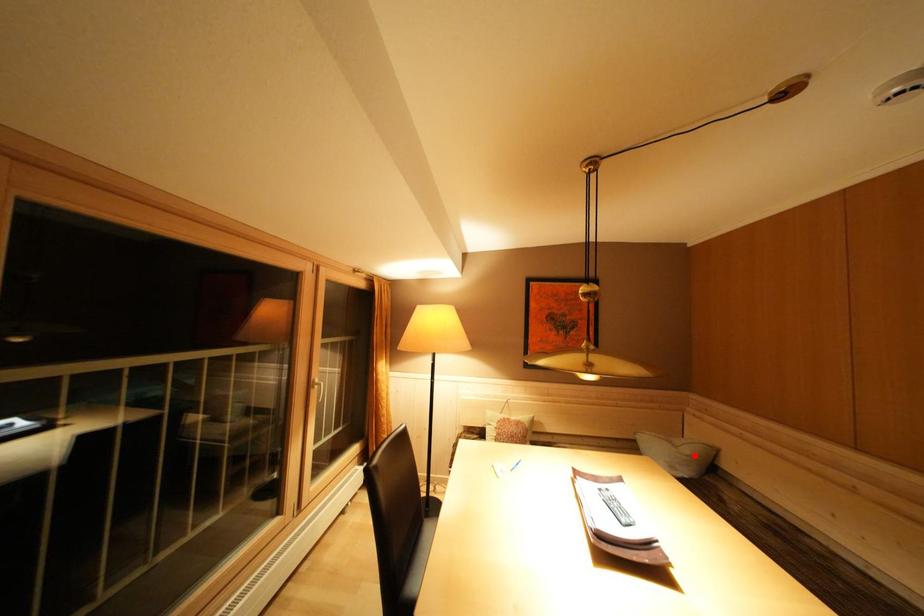
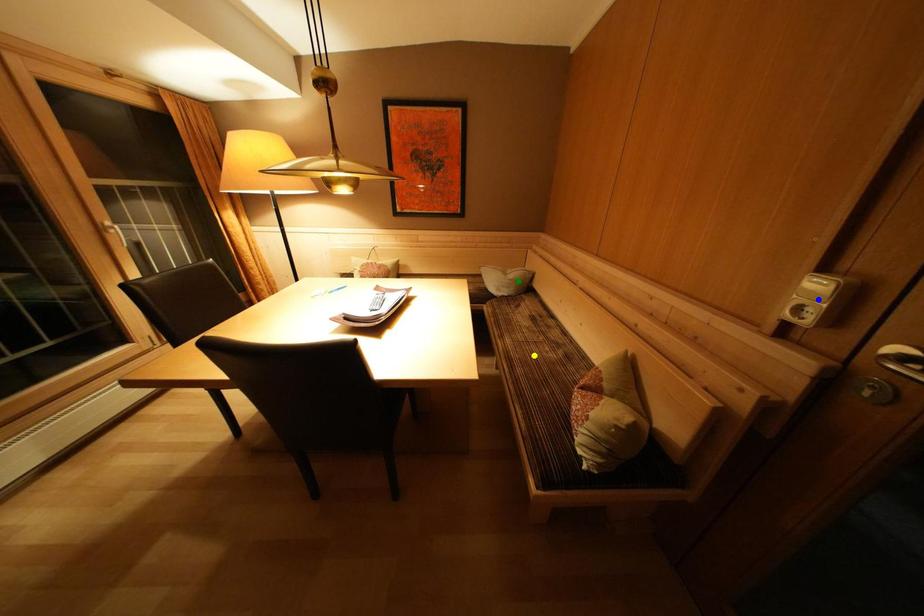
Question: I am providing you with two images of the same scene from different viewpoints. A red point is marked on the first image. You are given multiple points on the second image. Which mark in image 2 goes with the point in image 1?

Choices:
 (A) blue point
 (B) green point
 (C) yellow point

Answer: (B)